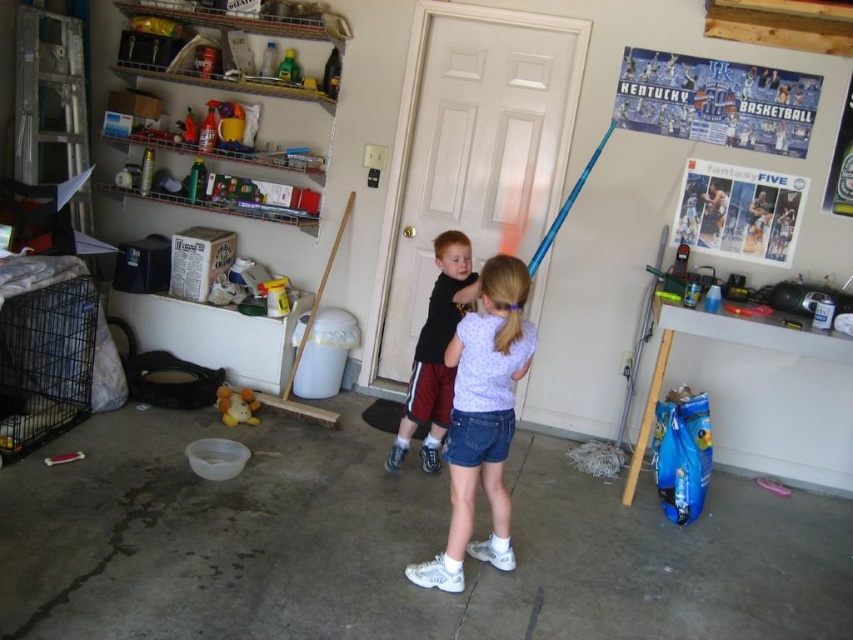
Question: Is denim shorts at center smaller than black matte shirt at center?

Choices:
 (A) yes
 (B) no

Answer: (A)

Question: Which of the following is the farthest from the observer?

Choices:
 (A) (474, 451)
 (B) (238, 419)

Answer: (B)

Question: Does black matte shirt at center appear over white plush toy at center?

Choices:
 (A) yes
 (B) no

Answer: (A)

Question: Considering the real-world distances, which object is closest to the denim shorts at center?

Choices:
 (A) black matte shirt at center
 (B) white plush toy at center

Answer: (A)

Question: Does denim shorts at center appear on the left side of black matte shirt at center?

Choices:
 (A) no
 (B) yes

Answer: (A)

Question: Which of the following is the closest to the observer?

Choices:
 (A) (440, 243)
 (B) (502, 556)

Answer: (B)